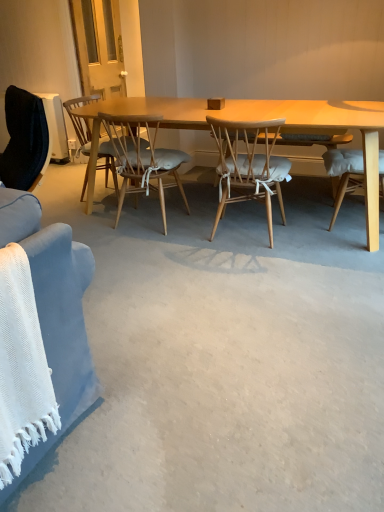
You are a GUI agent. You are given a task and a screenshot of the screen. Output one action in this format:
    pyautogui.click(x=<x>, y=<y>)
    Task: Click on the free point below light brown wood chair at center, the second chair in the right-to-left sequence (from a real-world perspective)
    The width and height of the screenshot is (384, 512).
    Given the screenshot: What is the action you would take?
    pyautogui.click(x=146, y=220)